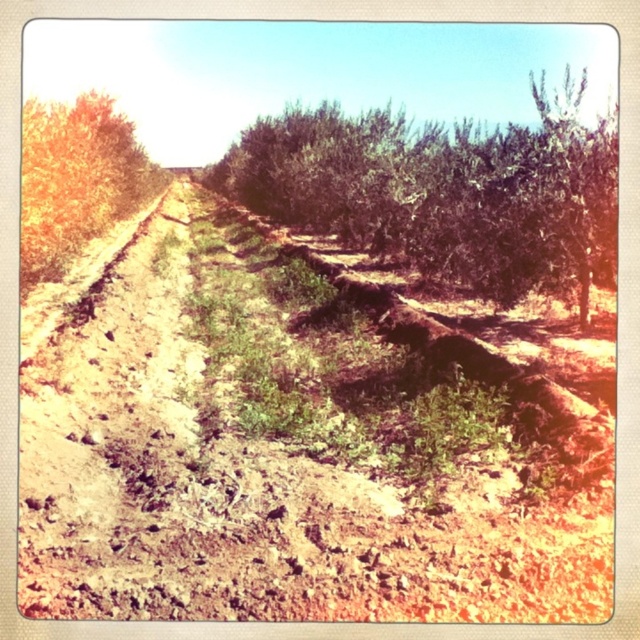
You are a hiker trying to navigate the eroded path. You notice a green leafy shrub at center and a green leafy tree at left. Which one is taller?

The green leafy shrub at center is taller than the green leafy tree at left.

You are a gardener planning to plant a new shrub in the brown soil at center. Since the green leafy shrub at center is already there, will the new shrub have enough space to grow around the existing one?

The brown soil at center is positioned under green leafy shrub at center, so the new shrub may not have enough space to grow around the existing one as the soil is already occupied by the existing shrub.

You are standing at the center of the dirt path in the rural scene. There is a green leafy shrub at center marked by point [445,193]. Which direction should you walk to avoid the eroded areas of the path?

The point [445,193] marks the green leafy shrub at center, so to avoid the eroded areas of the path, you should walk away from the shrub towards the flanking vegetation where the soil is less eroded.